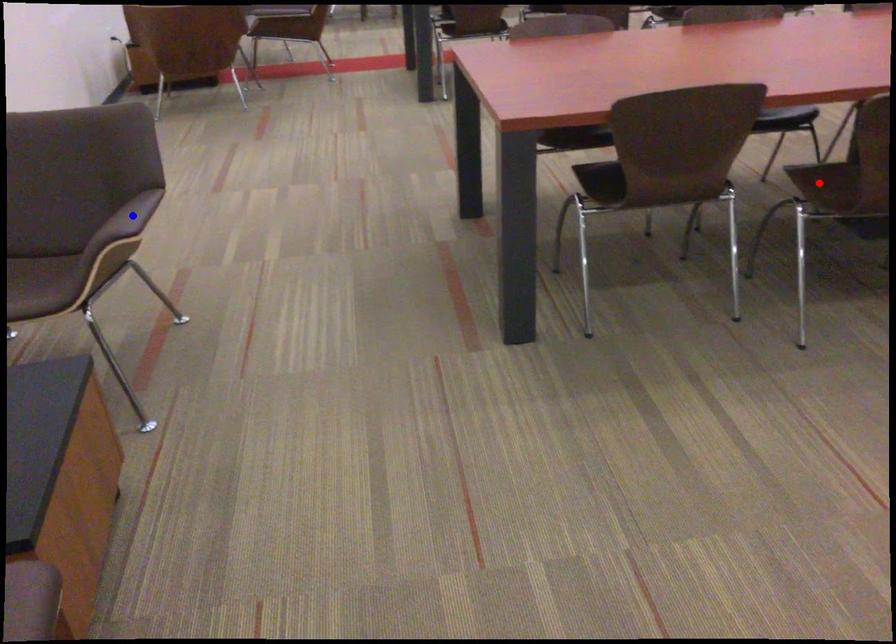
Question: Which of the two points in the image is closer to the camera?

Choices:
 (A) Blue point is closer.
 (B) Red point is closer.

Answer: (B)